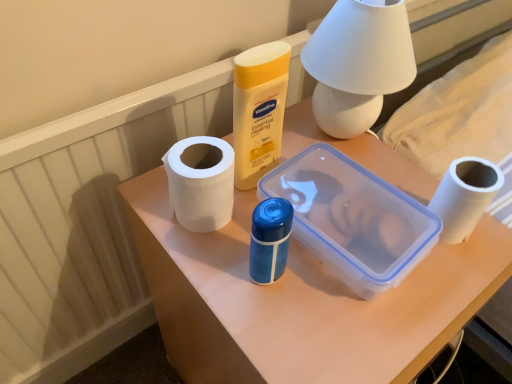
Question: Is white matte paper towel at center-left thinner than white matte toilet paper at right?

Choices:
 (A) yes
 (B) no

Answer: (B)

Question: From the image's perspective, is white matte paper towel at center-left on white matte toilet paper at right?

Choices:
 (A) yes
 (B) no

Answer: (A)

Question: Is white matte paper towel at center-left next to white matte toilet paper at right and touching it?

Choices:
 (A) yes
 (B) no

Answer: (B)

Question: Is white matte paper towel at center-left smaller than white matte toilet paper at right?

Choices:
 (A) no
 (B) yes

Answer: (A)

Question: Is white matte paper towel at center-left not inside white matte toilet paper at right?

Choices:
 (A) yes
 (B) no

Answer: (A)

Question: Considering the relative sizes of white matte paper towel at center-left and white matte toilet paper at right in the image provided, is white matte paper towel at center-left bigger than white matte toilet paper at right?

Choices:
 (A) no
 (B) yes

Answer: (B)

Question: Considering the relative positions of white matte toilet paper at right and white matte table lamp at upper center in the image provided, is white matte toilet paper at right to the right of white matte table lamp at upper center from the viewer's perspective?

Choices:
 (A) no
 (B) yes

Answer: (B)

Question: Is white matte toilet paper at right positioned in front of white matte table lamp at upper center?

Choices:
 (A) yes
 (B) no

Answer: (B)

Question: From a real-world perspective, is white matte toilet paper at right located beneath white matte table lamp at upper center?

Choices:
 (A) yes
 (B) no

Answer: (A)

Question: Considering the relative sizes of white matte toilet paper at right and white matte table lamp at upper center in the image provided, is white matte toilet paper at right wider than white matte table lamp at upper center?

Choices:
 (A) yes
 (B) no

Answer: (B)

Question: From the image's perspective, is white matte toilet paper at right below white matte table lamp at upper center?

Choices:
 (A) no
 (B) yes

Answer: (B)

Question: Is the depth of white matte toilet paper at right greater than that of white matte table lamp at upper center?

Choices:
 (A) yes
 (B) no

Answer: (A)

Question: Are white matte paper towel at center-left and white matte table lamp at upper center far apart?

Choices:
 (A) no
 (B) yes

Answer: (A)